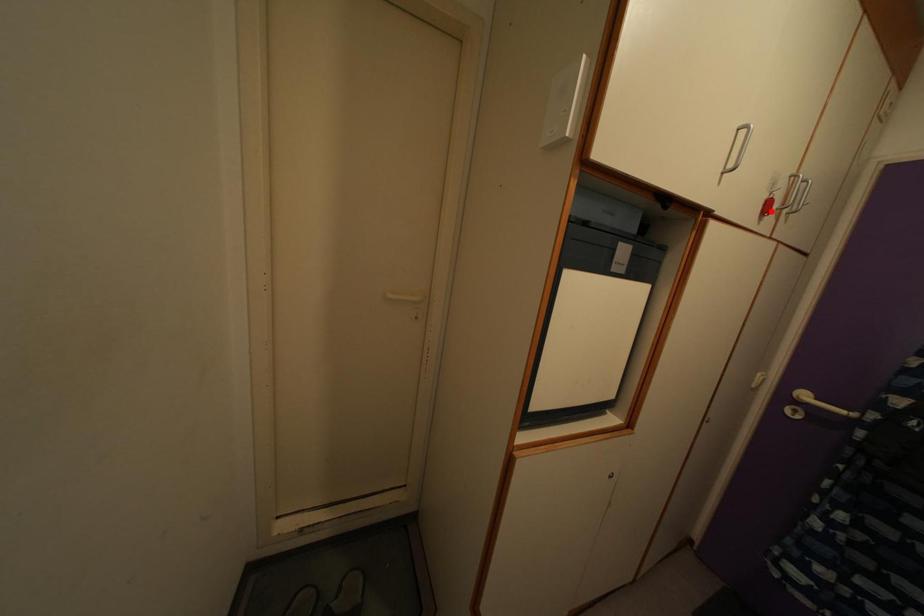
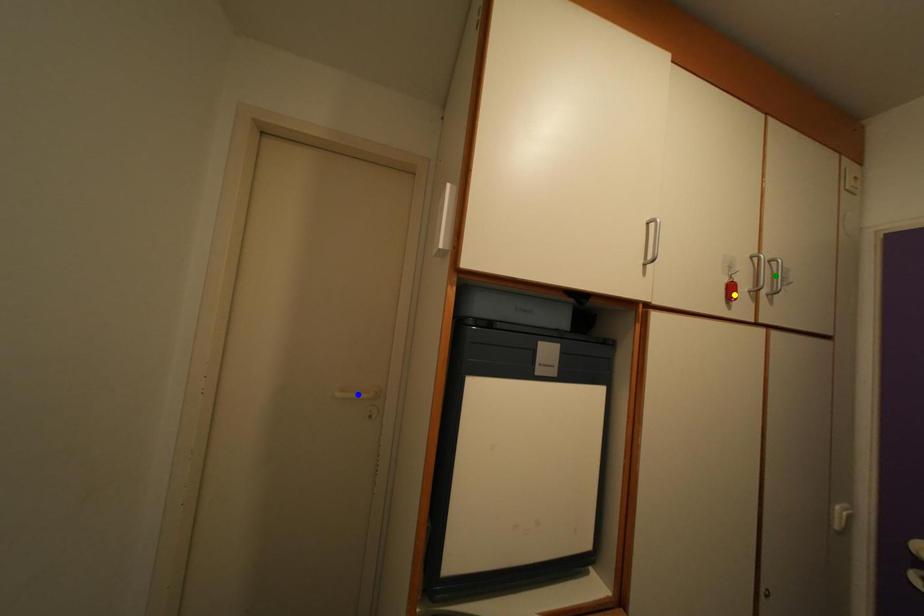
Question: I am providing you with two images of the same scene from different viewpoints. A red point is marked on the first image. You are given multiple points on the second image. Which mark in image 2 goes with the point in image 1?

Choices:
 (A) green point
 (B) yellow point
 (C) blue point

Answer: (B)